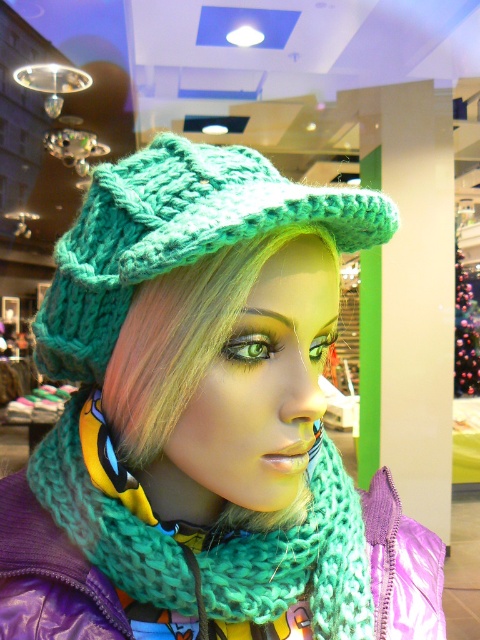
You are a customer in a store looking at two hats displayed on a mannequin. The knitted teal hat at center and the green knitted hat at center. Which hat is bigger?

The knitted teal hat at center is larger in size than the green knitted hat at center.

You are a customer in a store looking at the mannequin. You want to know if the teal knitted scarf at center can be fully seen without being covered by the green knitted hat at center. Can you determine this based on their heights?

The teal knitted scarf at center has a lesser height compared to the green knitted hat at center. Since the scarf is shorter, it is likely that the taller hat may cover part of the scarf, making it not fully visible.